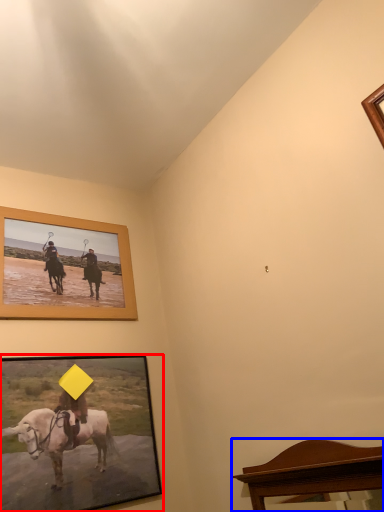
Question: Which object appears farthest to the camera in this image, picture frame (highlighted by a red box) or furniture (highlighted by a blue box)?

Choices:
 (A) picture frame
 (B) furniture

Answer: (A)